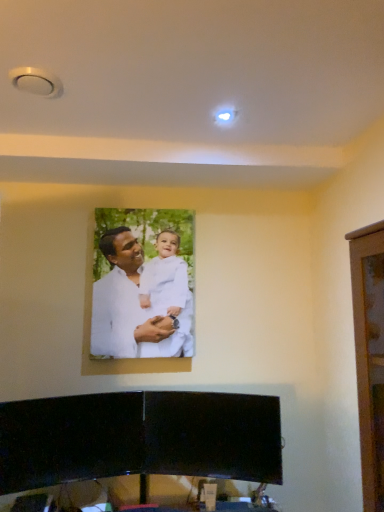
The width and height of the screenshot is (384, 512). I want to click on white matte portrait at center, so [134, 305].

What is the approximate height of white matte portrait at center?

white matte portrait at center is 75.37 centimeters tall.

Describe the element at coordinates (134, 305) in the screenshot. Image resolution: width=384 pixels, height=512 pixels. I see `white matte portrait at center` at that location.

The image size is (384, 512). Identify the location of white matte portrait at center. (134, 305).